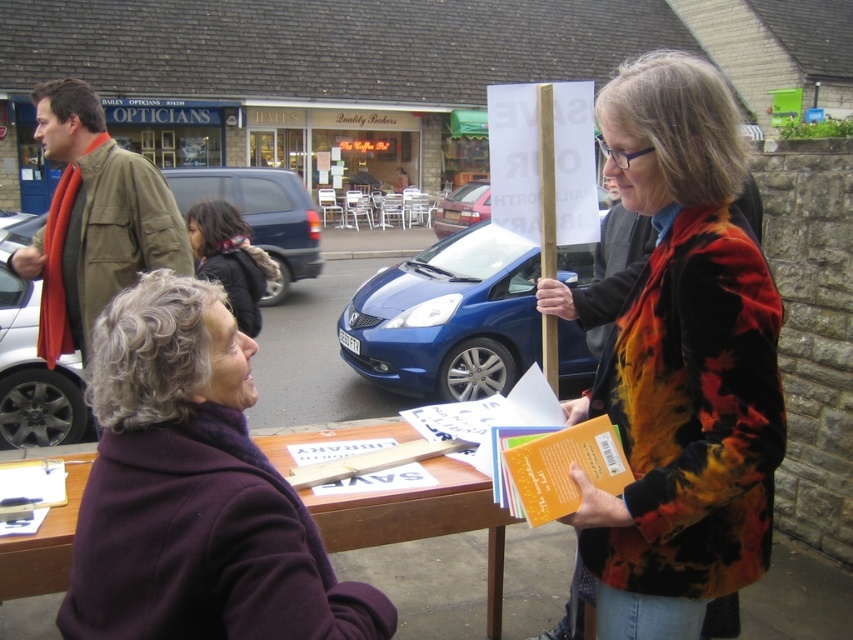
Question: Is velvet-like orange jacket at center smaller than metallic silver car at left?

Choices:
 (A) no
 (B) yes

Answer: (B)

Question: Which point is closer to the camera taking this photo?

Choices:
 (A) (305, 237)
 (B) (85, 598)

Answer: (B)

Question: Is blue metallic car at center further to the viewer compared to metallic silver car at center?

Choices:
 (A) yes
 (B) no

Answer: (B)

Question: Can you confirm if blue metallic car at center is positioned below blue metallic van at center-left?

Choices:
 (A) yes
 (B) no

Answer: (A)

Question: Which object is closer to the camera taking this photo?

Choices:
 (A) metallic silver car at left
 (B) metallic silver car at center
 (C) purple woolen coat at center

Answer: (C)

Question: Based on their relative distances, which object is farther from the dark brown leather jacket at center?

Choices:
 (A) blue metallic car at center
 (B) olive-green jacket at left
 (C) metallic silver car at center

Answer: (C)